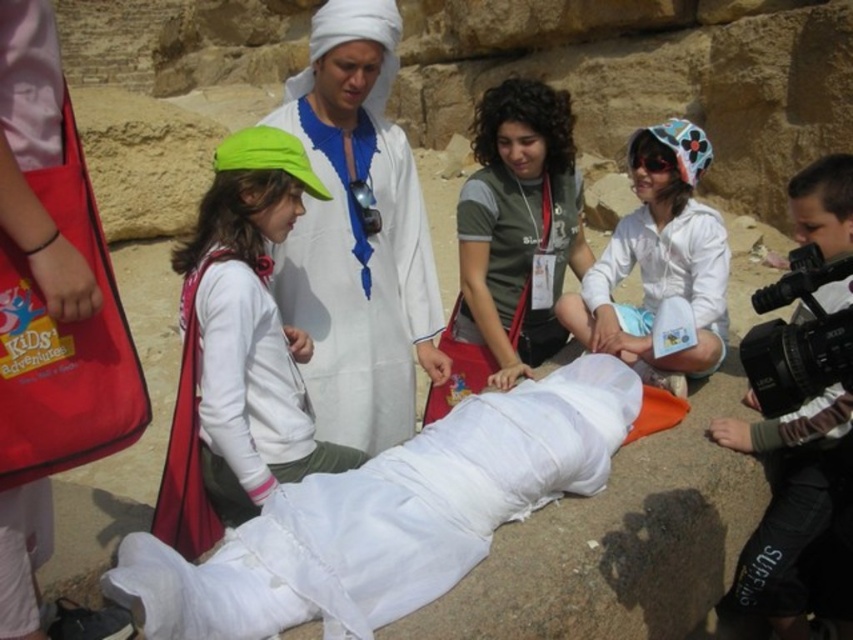
Measure the distance between white matte hat at upper right and white matte/soft fabric at lower right.

white matte hat at upper right and white matte/soft fabric at lower right are 22.79 feet apart.

Which of these two, white matte hat at upper right or white matte/soft fabric at lower right, stands taller?

Standing taller between the two is white matte hat at upper right.

Which is behind, point (694, 220) or point (827, 428)?

The point (694, 220) is behind.

At what (x,y) coordinates should I click in order to perform the action: click on white matte hat at upper right. Please return your answer as a coordinate pair (x, y). Image resolution: width=853 pixels, height=640 pixels. Looking at the image, I should click on (659, 257).

Find the location of `white cotton robe at center`. white cotton robe at center is located at coordinates coord(358,236).

Does white cotton robe at center come in front of white matte hat at upper right?

No, it is behind white matte hat at upper right.

The height and width of the screenshot is (640, 853). What do you see at coordinates (358, 236) in the screenshot? I see `white cotton robe at center` at bounding box center [358, 236].

Locate an element on the screen. This screenshot has width=853, height=640. white cotton robe at center is located at coordinates (358, 236).

Does green fabric cap at upper left have a greater height compared to green fabric shirt at center?

No, green fabric cap at upper left is not taller than green fabric shirt at center.

Is green fabric cap at upper left closer to the viewer compared to green fabric shirt at center?

Yes.

Image resolution: width=853 pixels, height=640 pixels. What are the coordinates of `green fabric cap at upper left` in the screenshot? It's located at (251, 326).

The width and height of the screenshot is (853, 640). I want to click on green fabric cap at upper left, so click(x=251, y=326).